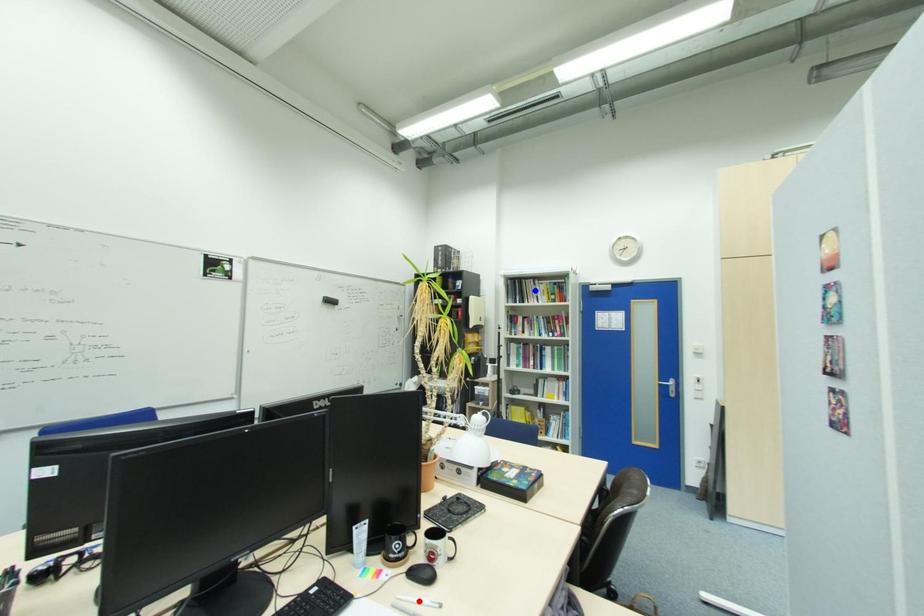
Question: In the image, two points are highlighted. Which point is nearer to the camera? Reply with the corresponding letter.

Choices:
 (A) blue point
 (B) red point

Answer: (B)